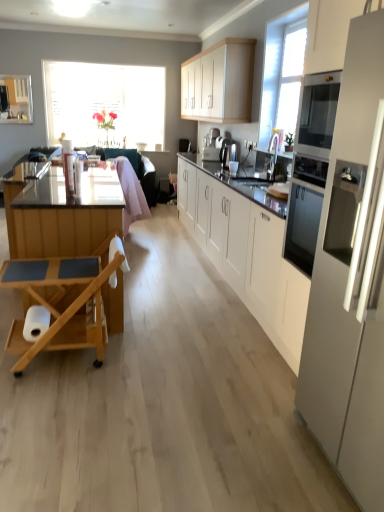
Question: Considering the positions of translucent glass window at upper left and white matte cabinet at center, which ranks as the second cabinetry in top-to-bottom order, in the image, is translucent glass window at upper left taller or shorter than white matte cabinet at center, which ranks as the second cabinetry in top-to-bottom order,?

Choices:
 (A) short
 (B) tall

Answer: (B)

Question: Is point (135, 118) positioned closer to the camera than point (259, 187)?

Choices:
 (A) closer
 (B) farther

Answer: (B)

Question: Based on their relative distances, which object is nearer to the pink fabric swivel chair at center?

Choices:
 (A) wooden rolling cart at left
 (B) translucent glass window at upper left
 (C) white glossy sink at center
 (D) white matte cabinet at center, placed as the first cabinetry when sorted from bottom to top
 (E) white glossy refrigerator at right

Answer: (B)

Question: Which of these objects is positioned farthest from the translucent glass window at upper left?

Choices:
 (A) white glossy sink at center
 (B) white glossy refrigerator at right
 (C) pink fabric swivel chair at center
 (D) white matte cabinet at upper center, which is the 2th cabinetry from bottom to top
 (E) satin silver coffee machine at center

Answer: (B)